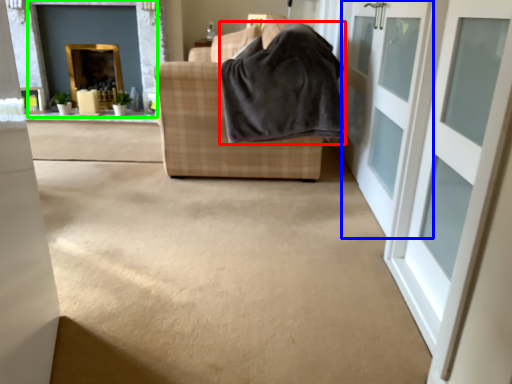
Question: Which object is positioned farthest from blanket (highlighted by a red box)? Select from door (highlighted by a blue box) and fireplace (highlighted by a green box).

Choices:
 (A) door
 (B) fireplace

Answer: (B)